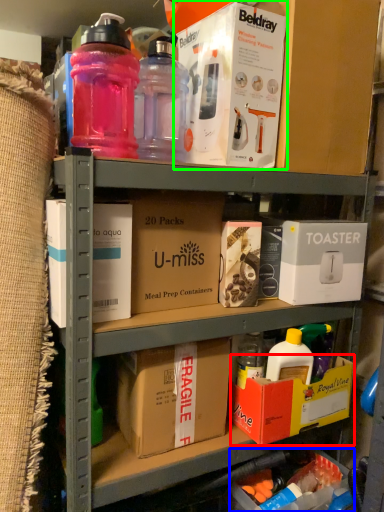
Question: Which object is positioned farthest from box (highlighted by a red box)? Select from box (highlighted by a blue box) and box (highlighted by a green box).

Choices:
 (A) box
 (B) box

Answer: (B)